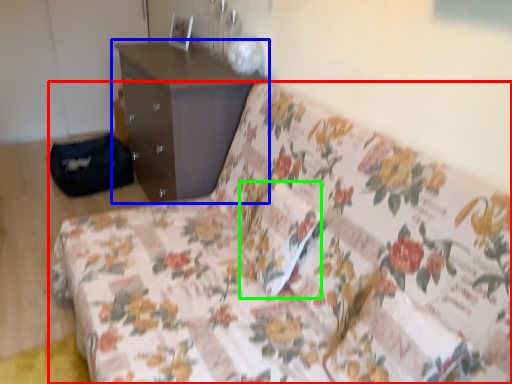
Question: Which object is positioned farthest from studio couch (highlighted by a red box)? Select from chest of drawers (highlighted by a blue box) and pillow (highlighted by a green box).

Choices:
 (A) chest of drawers
 (B) pillow

Answer: (A)